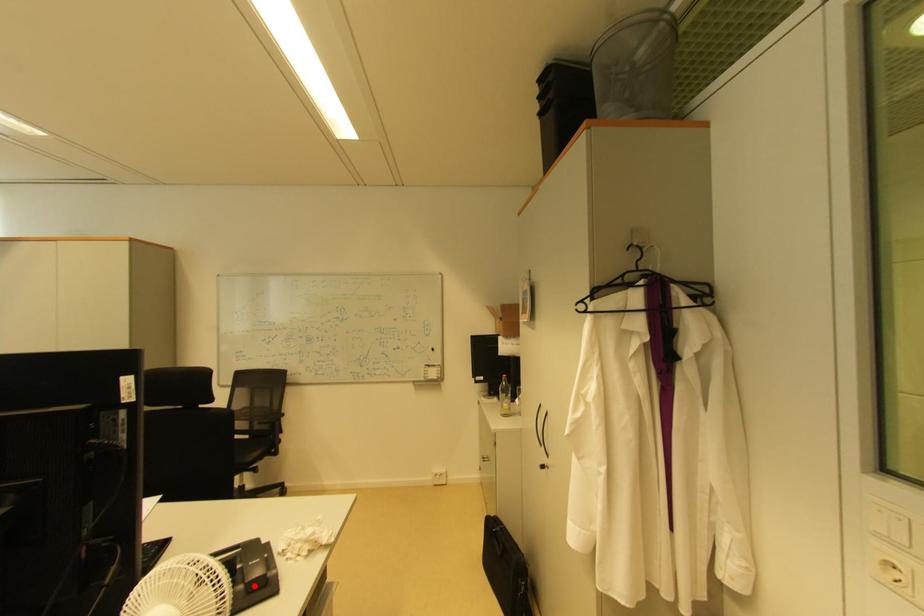
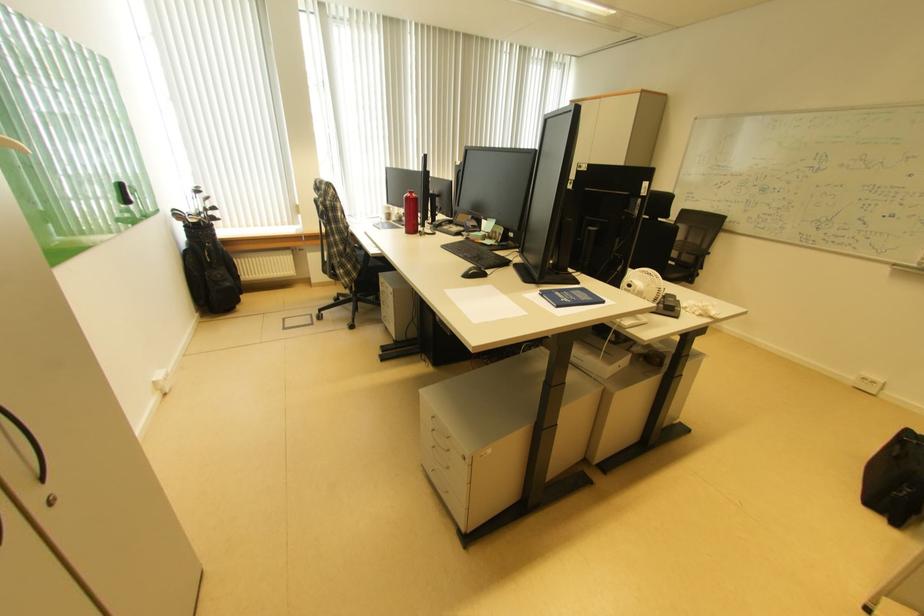
Where in the second image is the point corresponding to the highlighted location from the first image?

(673, 306)